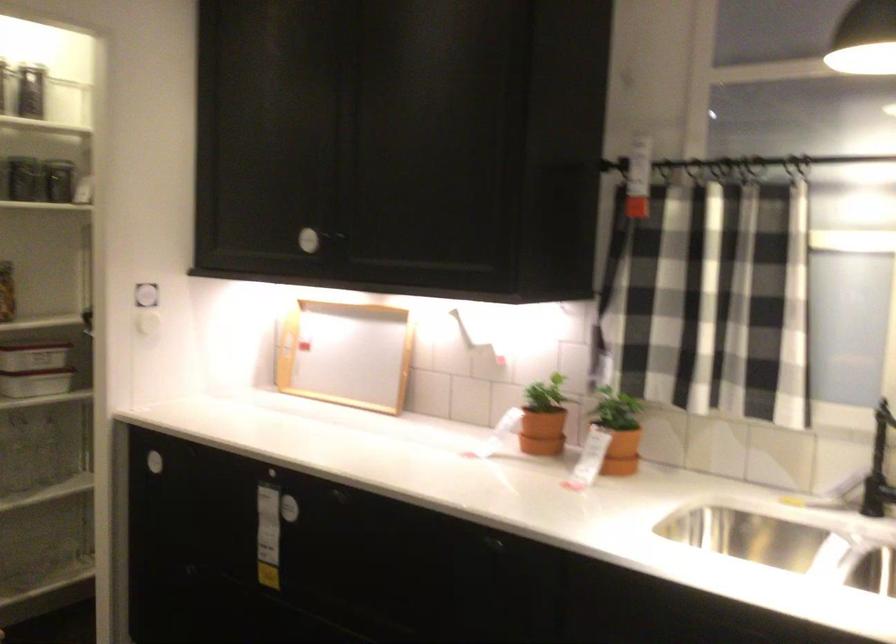
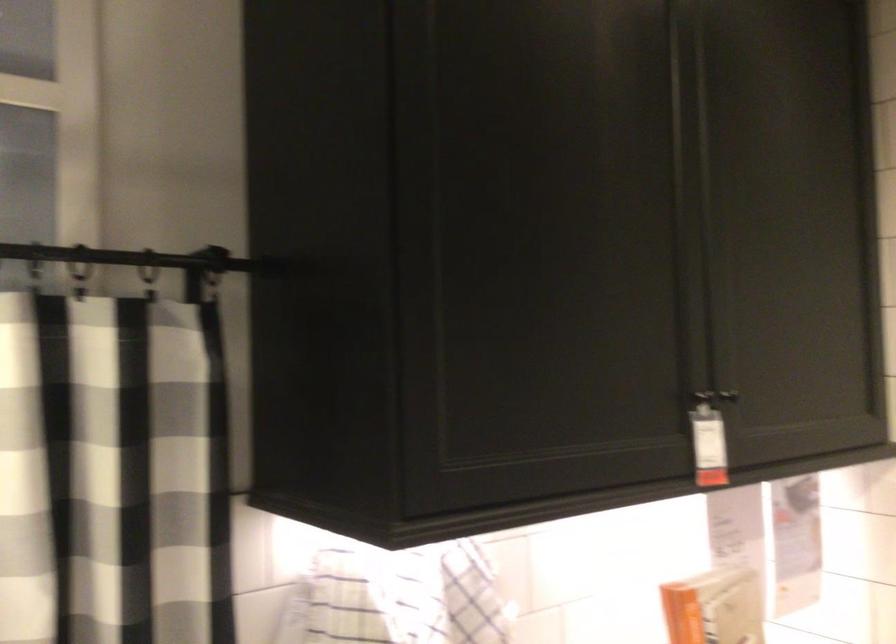
Question: The first image is from the beginning of the video and the second image is from the end. How did the camera likely rotate when shooting the video?

Choices:
 (A) Left
 (B) Right
 (C) Up
 (D) Down

Answer: (B)